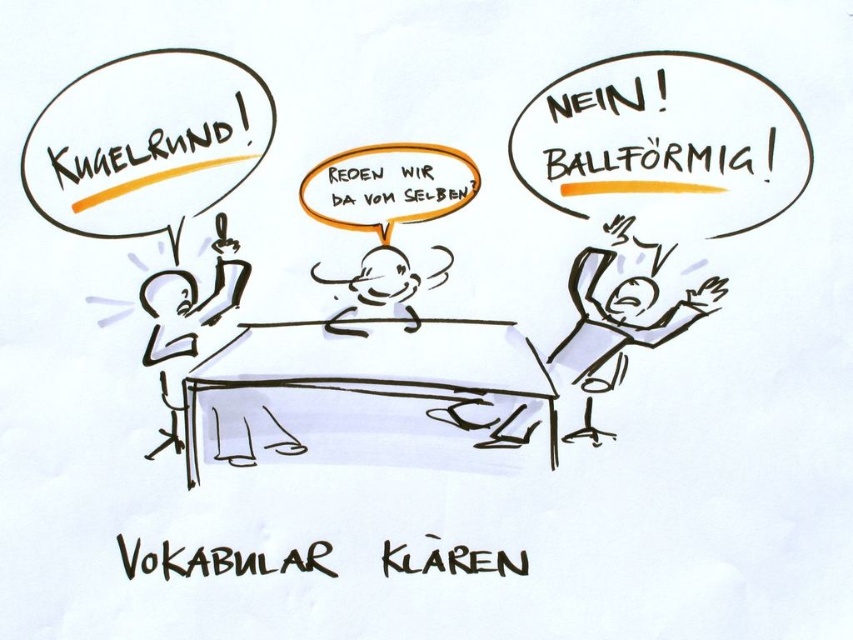
You are a robot with a height of 1.5 meters. You are standing at point (109, 232). Can you reach the top of the table which is 1.2 meters high?

The distance between you and the table is 94.62 centimeters. Since the table is 1.2 meters high and you are 1.5 meters tall, you can reach the top of the table.

Based on the scene description, which object has a larger size between the yellow marker text at upper left and the smooth white head at center?

The yellow marker text at upper left has a larger size compared to the smooth white head at center.

You are an assistant who needs to determine the relative sizes of objects in the image. According to the scene, which object is taller between the yellow marker text at upper left and the gray paper at center?

The gray paper at center is taller than the yellow marker text at upper left.